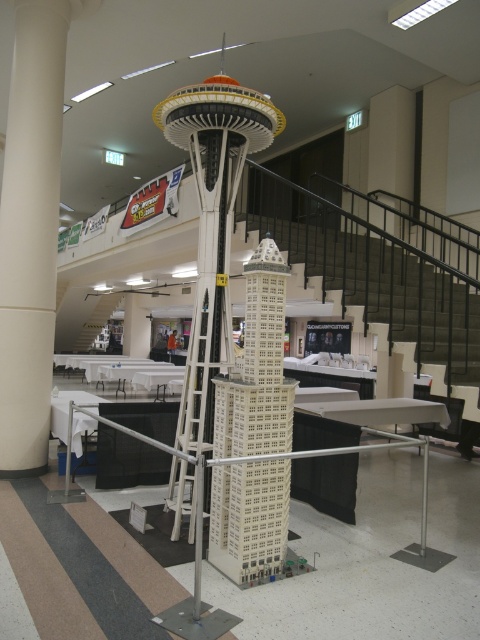
Question: Is white smooth pillar at center thinner than white plastic building at center?

Choices:
 (A) no
 (B) yes

Answer: (A)

Question: Which point is farther from the camera taking this photo?

Choices:
 (A) (0, 204)
 (B) (255, 515)

Answer: (A)

Question: Which of the following is the farthest from the observer?

Choices:
 (A) (285, 419)
 (B) (27, 176)

Answer: (B)

Question: Which point is closer to the camera taking this photo?

Choices:
 (A) (33, 81)
 (B) (276, 428)

Answer: (B)

Question: Does white smooth pillar at center have a lesser width compared to white plastic building at center?

Choices:
 (A) yes
 (B) no

Answer: (B)

Question: Can you confirm if white smooth pillar at center is thinner than white plastic building at center?

Choices:
 (A) no
 (B) yes

Answer: (A)